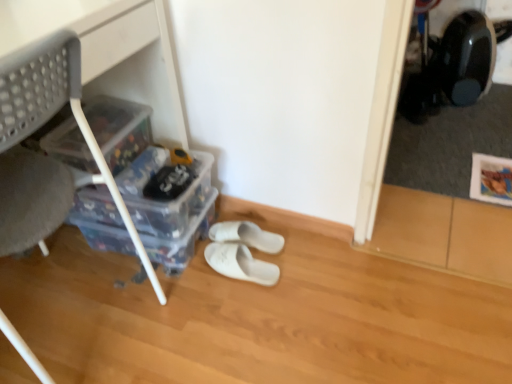
Where is `free space on the front side of white fabric slippers at center, the first footwear from the front`? This screenshot has height=384, width=512. free space on the front side of white fabric slippers at center, the first footwear from the front is located at coordinates (239, 312).